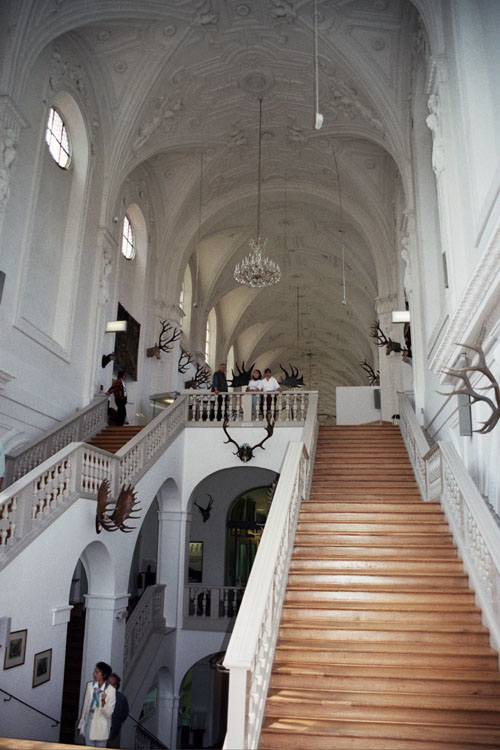
Image resolution: width=500 pixels, height=750 pixels. In order to click on brown horizontal steps of brown staircase in this screenshot , I will do `click(405, 576)`, `click(404, 682)`, `click(335, 612)`, `click(361, 528)`, `click(364, 436)`, `click(383, 466)`.